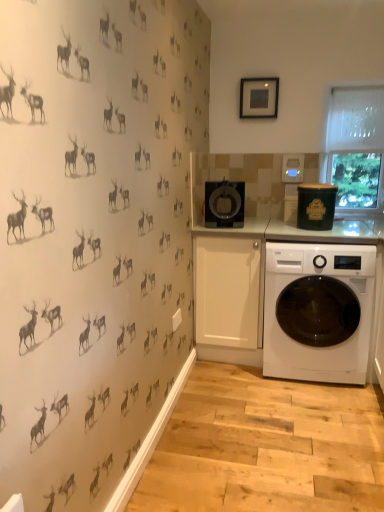
Question: Is black glossy coffee maker at center, the 1th appliance positioned from the left, smaller than white glossy washing machine at lower right?

Choices:
 (A) yes
 (B) no

Answer: (A)

Question: Can you confirm if black glossy coffee maker at center, the 1th appliance positioned from the left, is wider than white glossy washing machine at lower right?

Choices:
 (A) no
 (B) yes

Answer: (A)

Question: Can we say black glossy coffee maker at center, which ranks as the 2th appliance in right-to-left order, lies outside white glossy washing machine at lower right?

Choices:
 (A) no
 (B) yes

Answer: (B)

Question: Is there a large distance between black glossy coffee maker at center, the 1th appliance positioned from the left, and white glossy washing machine at lower right?

Choices:
 (A) yes
 (B) no

Answer: (B)

Question: Is black glossy coffee maker at center, the 1th appliance positioned from the left, in front of white glossy washing machine at lower right?

Choices:
 (A) no
 (B) yes

Answer: (A)

Question: Is point pos(274,106) closer or farther from the camera than point pos(215,211)?

Choices:
 (A) farther
 (B) closer

Answer: (A)

Question: Would you say matte black picture frame at upper center is inside or outside black glossy coffee maker at center, the 1th appliance positioned from the left?

Choices:
 (A) inside
 (B) outside

Answer: (B)

Question: From the image's perspective, relative to black glossy coffee maker at center, the 1th appliance positioned from the left, is matte black picture frame at upper center above or below?

Choices:
 (A) above
 (B) below

Answer: (A)

Question: Relative to black glossy coffee maker at center, which ranks as the 2th appliance in right-to-left order, is matte black picture frame at upper center in front or behind?

Choices:
 (A) behind
 (B) front

Answer: (A)

Question: From a real-world perspective, is black glossy coffee maker at center, the 1th appliance positioned from the left, positioned above or below white glossy washing machine at lower right?

Choices:
 (A) above
 (B) below

Answer: (A)

Question: In the image, is black glossy coffee maker at center, the 1th appliance positioned from the left, positioned in front of or behind white glossy washing machine at lower right?

Choices:
 (A) behind
 (B) front

Answer: (A)

Question: Looking at the image, does black glossy coffee maker at center, which ranks as the 2th appliance in right-to-left order, seem bigger or smaller compared to white glossy washing machine at lower right?

Choices:
 (A) small
 (B) big

Answer: (A)

Question: Does point (208, 212) appear closer or farther from the camera than point (316, 352)?

Choices:
 (A) farther
 (B) closer

Answer: (A)

Question: Considering their positions, is green matte canister at upper right, which is the second appliance from left to right, located in front of or behind matte black picture frame at upper center?

Choices:
 (A) front
 (B) behind

Answer: (A)

Question: Based on their sizes in the image, would you say green matte canister at upper right, which is the second appliance from left to right, is bigger or smaller than matte black picture frame at upper center?

Choices:
 (A) small
 (B) big

Answer: (B)